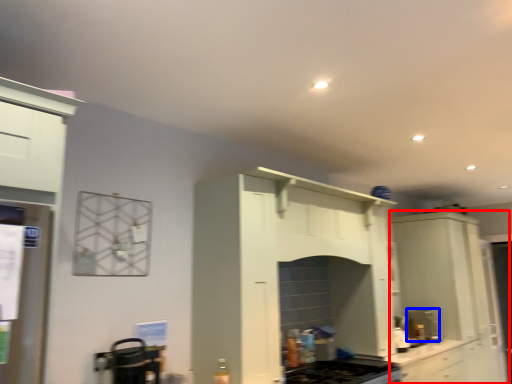
Question: Among these objects, which one is nearest to the camera, cabinetry (highlighted by a red box) or coffee machine (highlighted by a blue box)?

Choices:
 (A) cabinetry
 (B) coffee machine

Answer: (A)